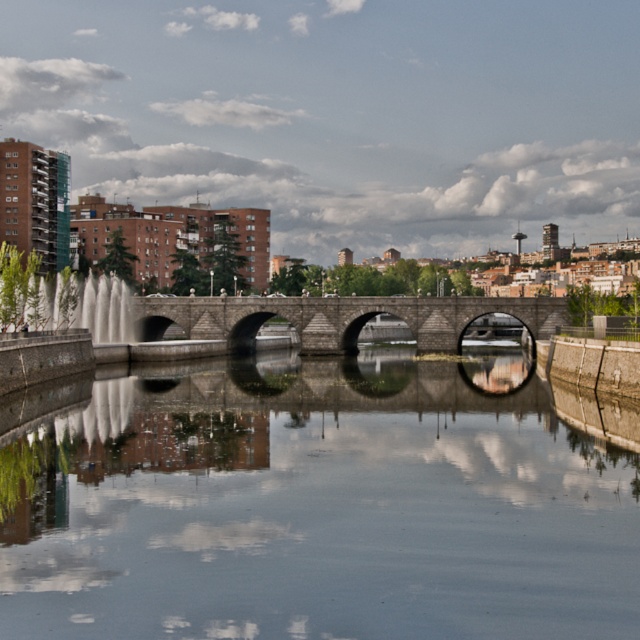
Question: Which point is closer to the camera taking this photo?

Choices:
 (A) click(x=285, y=316)
 (B) click(x=288, y=632)

Answer: (B)

Question: Which point is farther to the camera?

Choices:
 (A) stone bridge at center
 (B) smooth concrete water at center

Answer: (A)

Question: Can you confirm if smooth concrete water at center is positioned above stone bridge at center?

Choices:
 (A) yes
 (B) no

Answer: (B)

Question: Is smooth concrete water at center smaller than stone bridge at center?

Choices:
 (A) yes
 (B) no

Answer: (A)

Question: Is smooth concrete water at center thinner than stone bridge at center?

Choices:
 (A) yes
 (B) no

Answer: (A)

Question: Which point is farther from the camera taking this photo?

Choices:
 (A) (189, 420)
 (B) (138, 336)

Answer: (B)